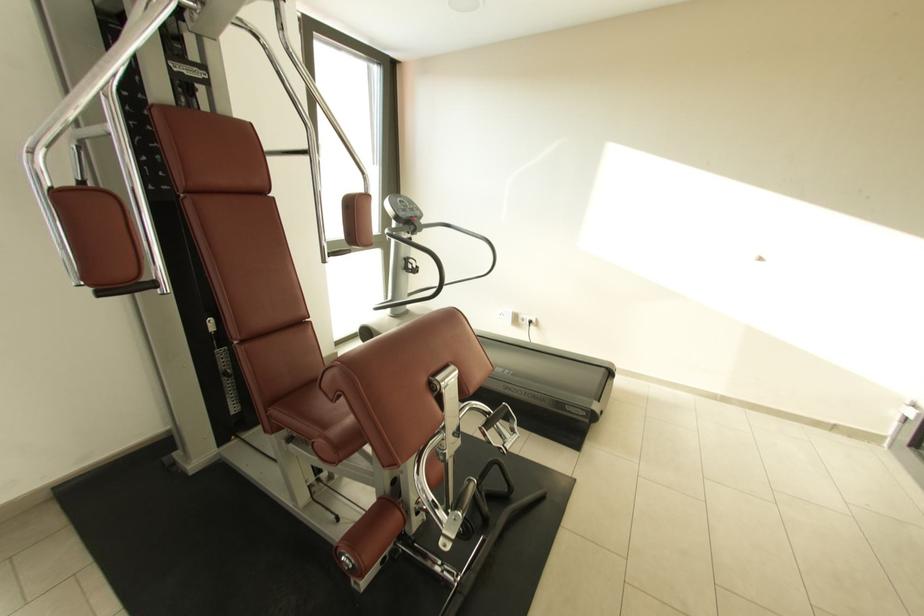
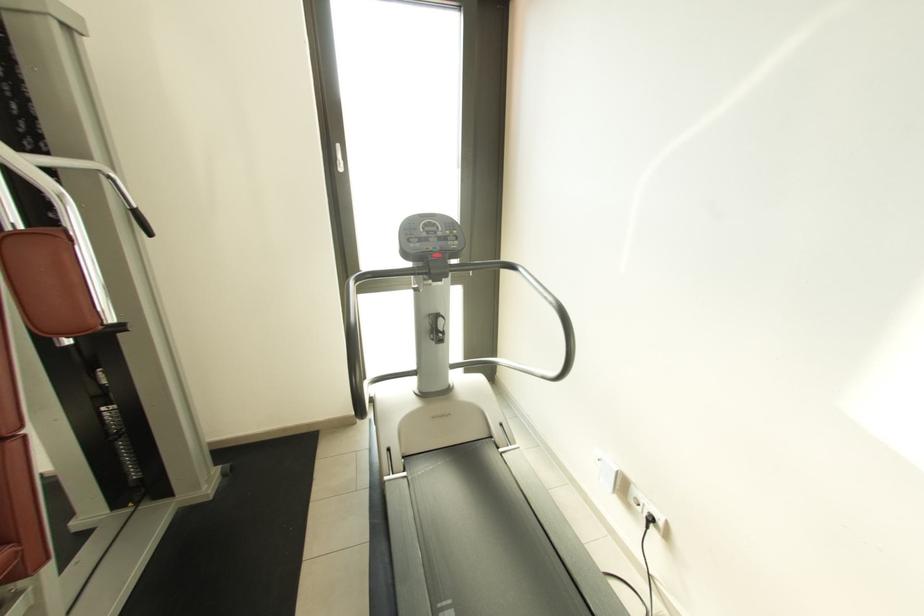
Find the pixel in the second image that matches point (409, 205) in the first image.

(439, 230)